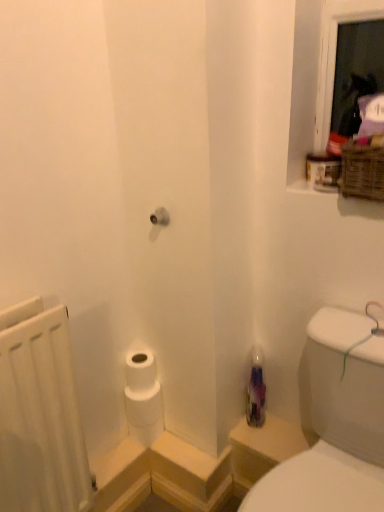
I want to click on transparent plastic bottle at lower right, so click(335, 424).

Where is `woven brown basket at upper right`? The width and height of the screenshot is (384, 512). woven brown basket at upper right is located at coordinates (362, 170).

Can we say translucent purple bottle at lower right lies outside white matte toilet paper at lower left?

Indeed, translucent purple bottle at lower right is completely outside white matte toilet paper at lower left.

Between translucent purple bottle at lower right and white matte toilet paper at lower left, which one has less height?

white matte toilet paper at lower left.

Is translucent purple bottle at lower right with white matte toilet paper at lower left?

No, translucent purple bottle at lower right is not touching white matte toilet paper at lower left.

The height and width of the screenshot is (512, 384). Identify the location of toilet paper to the left of translucent purple bottle at lower right. (144, 413).

How much distance is there between woven brown basket at upper right and white matte radiator at left?

They are 36.71 inches apart.

How different are the orientations of woven brown basket at upper right and white matte radiator at left in degrees?

The angular difference between woven brown basket at upper right and white matte radiator at left is 83.9 degrees.

Which of these two, woven brown basket at upper right or white matte radiator at left, is bigger?

With larger size is white matte radiator at left.

From a real-world perspective, is woven brown basket at upper right on white matte radiator at left?

Yes, from a real-world perspective, woven brown basket at upper right is on top of white matte radiator at left.

Is point (10, 501) in front of point (155, 424)?

Yes.

From the picture: In terms of size, does white matte radiator at left appear bigger or smaller than white matte toilet paper at lower left?

Clearly, white matte radiator at left is larger in size than white matte toilet paper at lower left.

Does white matte radiator at left have a greater width compared to white matte toilet paper at lower left?

Yes.

Considering the sizes of white matte toilet paper at lower left and translucent purple bottle at lower right in the image, is white matte toilet paper at lower left wider or thinner than translucent purple bottle at lower right?

In the image, white matte toilet paper at lower left appears to be wider than translucent purple bottle at lower right.

Is white matte toilet paper at lower left facing away from translucent purple bottle at lower right?

No, translucent purple bottle at lower right is not at the back of white matte toilet paper at lower left.

From a real-world perspective, is white matte toilet paper at lower left positioned under translucent purple bottle at lower right based on gravity?

Yes, from a real-world perspective, white matte toilet paper at lower left is below translucent purple bottle at lower right.

Is translucent purple bottle at lower right far away from woven brown basket at upper right?

No, translucent purple bottle at lower right is in close proximity to woven brown basket at upper right.

Which is more to the left, translucent purple bottle at lower right or woven brown basket at upper right?

translucent purple bottle at lower right is more to the left.

Is translucent purple bottle at lower right positioned with its back to woven brown basket at upper right?

No.

At what (x,y) coordinates should I click in order to perform the action: click on sink below the woven brown basket at upper right (from a real-world perspective). Please return your answer as a coordinate pair (x, y). Looking at the image, I should click on (335, 424).

Is woven brown basket at upper right bigger than transparent plastic bottle at lower right?

No.

Which is correct: woven brown basket at upper right is inside transparent plastic bottle at lower right, or outside of it?

woven brown basket at upper right is outside transparent plastic bottle at lower right.

From a real-world perspective, is woven brown basket at upper right positioned over transparent plastic bottle at lower right based on gravity?

Correct, in the physical world, woven brown basket at upper right is higher than transparent plastic bottle at lower right.

Considering their positions, is translucent purple bottle at lower right located in front of or behind white matte radiator at left?

translucent purple bottle at lower right is positioned farther from the viewer than white matte radiator at left.

Considering the positions of point (249, 424) and point (69, 492), is point (249, 424) closer or farther from the camera than point (69, 492)?

Point (249, 424) is farther from the camera than point (69, 492).

Is translucent purple bottle at lower right positioned far away from white matte radiator at left?

No.

Looking at this image, can you tell me how much translucent purple bottle at lower right and white matte radiator at left differ in facing direction?

The angular difference between translucent purple bottle at lower right and white matte radiator at left is 89.5 degrees.

The width and height of the screenshot is (384, 512). Find the location of `bottle in front of the white matte toilet paper at lower left`. bottle in front of the white matte toilet paper at lower left is located at coordinates (256, 391).

This screenshot has width=384, height=512. I want to click on basket above the white matte radiator at left (from a real-world perspective), so click(x=362, y=170).

Estimate the real-world distances between objects in this image. Which object is closer to translucent purple bottle at lower right, transparent plastic bottle at lower right or woven brown basket at upper right?

transparent plastic bottle at lower right.

Looking at the image, which one is located further to woven brown basket at upper right, white matte toilet paper at lower left or transparent plastic bottle at lower right?

white matte toilet paper at lower left is positioned further to the anchor woven brown basket at upper right.

Based on their spatial positions, is white matte toilet paper at lower left or transparent plastic bottle at lower right further from translucent purple bottle at lower right?

transparent plastic bottle at lower right lies further to translucent purple bottle at lower right than the other object.

Considering their positions, is white matte radiator at left positioned closer to translucent purple bottle at lower right than transparent plastic bottle at lower right?

Among the two, transparent plastic bottle at lower right is located nearer to translucent purple bottle at lower right.

Based on the photo, looking at the image, which one is located further to white matte toilet paper at lower left, transparent plastic bottle at lower right or woven brown basket at upper right?

woven brown basket at upper right is positioned further to the anchor white matte toilet paper at lower left.

Estimate the real-world distances between objects in this image. Which object is closer to woven brown basket at upper right, white matte radiator at left or translucent purple bottle at lower right?

translucent purple bottle at lower right.

Looking at the image, which one is located further to white matte radiator at left, woven brown basket at upper right or white matte toilet paper at lower left?

woven brown basket at upper right is positioned further to the anchor white matte radiator at left.

Looking at the image, which one is located further to translucent purple bottle at lower right, transparent plastic bottle at lower right or white matte toilet paper at lower left?

transparent plastic bottle at lower right.

Find the location of a particular element. bottle located between white matte radiator at left and woven brown basket at upper right in the left-right direction is located at coordinates (256, 391).

The height and width of the screenshot is (512, 384). Identify the location of sink situated between white matte radiator at left and woven brown basket at upper right from left to right. click(335, 424).

The height and width of the screenshot is (512, 384). I want to click on toilet paper between woven brown basket at upper right and transparent plastic bottle at lower right in the up-down direction, so click(x=144, y=413).

At what (x,y) coordinates should I click in order to perform the action: click on bottle that lies between woven brown basket at upper right and white matte toilet paper at lower left from top to bottom. Please return your answer as a coordinate pair (x, y). The height and width of the screenshot is (512, 384). Looking at the image, I should click on point(256,391).